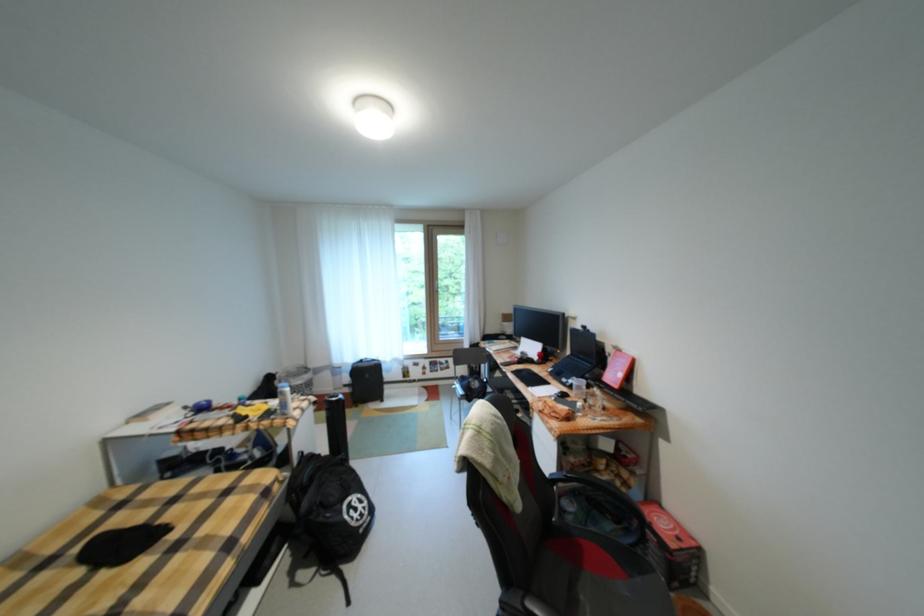
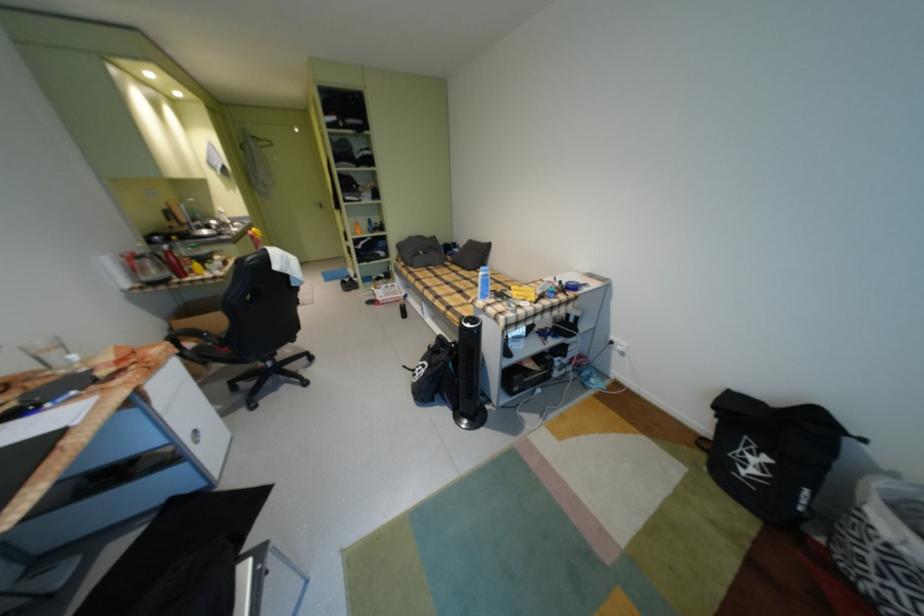
The point at (309, 387) is marked in the first image. Where is the corresponding point in the second image?

(882, 529)